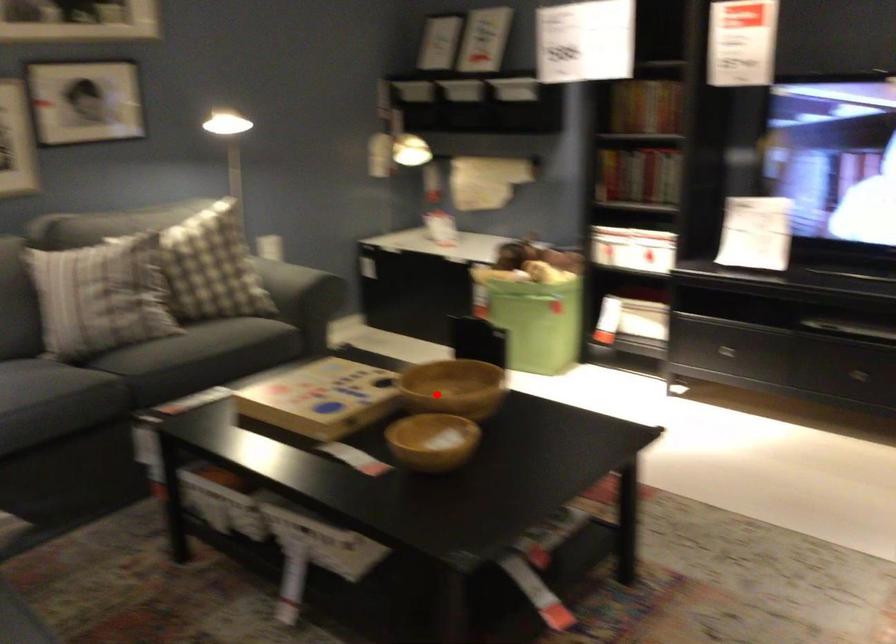
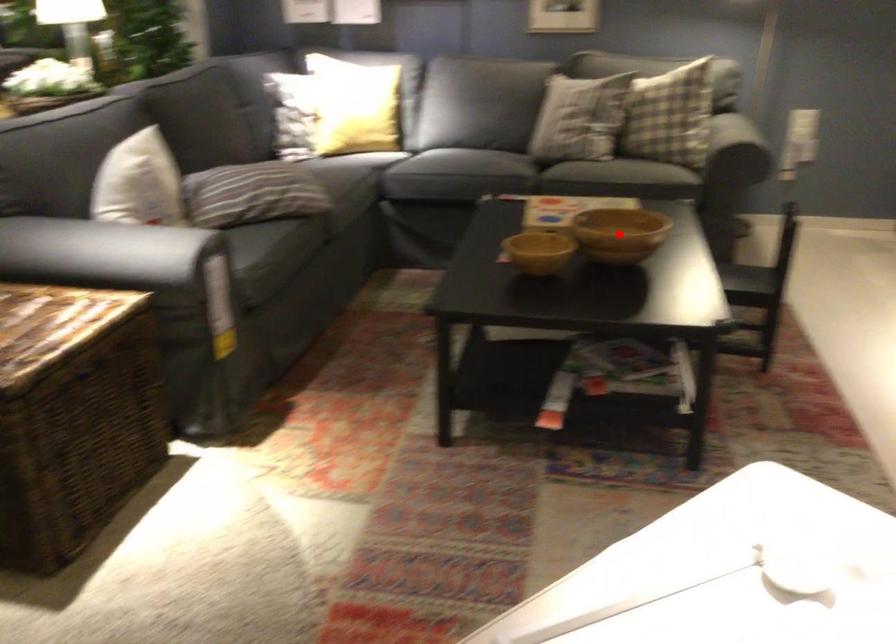
I am providing you with two images of the same scene from different viewpoints. A red point is marked on the first image and another point is marked on the second image. Do the highlighted points in image1 and image2 indicate the same real-world spot?

No